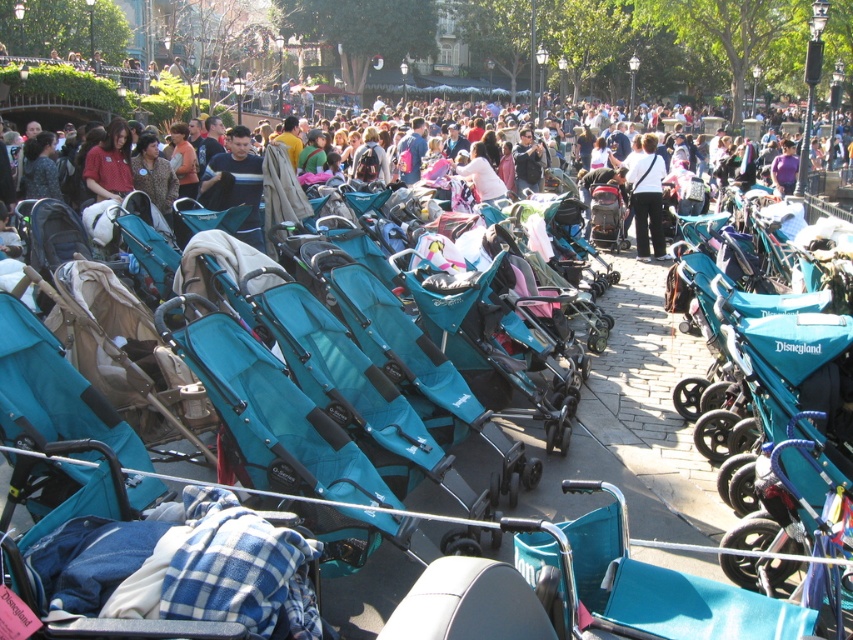
Question: Does teal fabric stroller at center come behind matte teal stroller at center?

Choices:
 (A) no
 (B) yes

Answer: (A)

Question: Which point is farther to the camera?

Choices:
 (A) teal strollers at center
 (B) dark blue jeans at center

Answer: (B)

Question: Which point is closer to the camera?

Choices:
 (A) dark blue jeans at center
 (B) matte teal stroller at center

Answer: (B)

Question: Is the position of teal fabric stroller at center more distant than that of teal strollers at center?

Choices:
 (A) yes
 (B) no

Answer: (B)

Question: Which object is closer to the camera taking this photo?

Choices:
 (A) dark blue jeans at center
 (B) teal fabric stroller at center
 (C) teal strollers at center

Answer: (B)

Question: Does teal strollers at center appear over dark blue jeans at center?

Choices:
 (A) yes
 (B) no

Answer: (A)